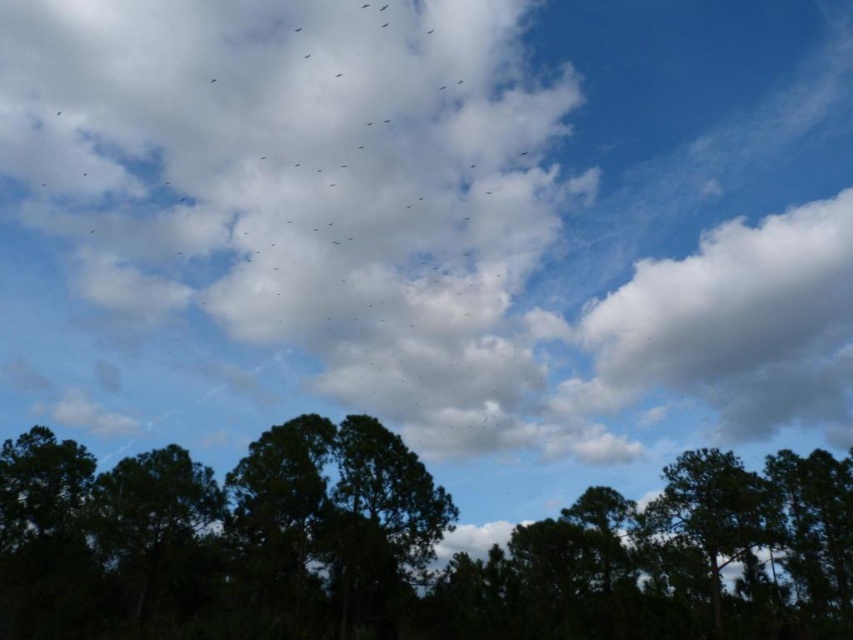
Question: Does white fluffy cloud at upper center appear on the right side of dark green foliage at center?

Choices:
 (A) yes
 (B) no

Answer: (B)

Question: Among these points, which one is farthest from the camera?

Choices:
 (A) (543, 435)
 (B) (519, 576)

Answer: (A)

Question: Which object appears farthest from the camera in this image?

Choices:
 (A) white fluffy cloud at upper center
 (B) dark green foliage at center

Answer: (A)

Question: Is white fluffy cloud at upper center to the left of dark green foliage at center from the viewer's perspective?

Choices:
 (A) no
 (B) yes

Answer: (B)

Question: Considering the relative positions of white fluffy cloud at upper center and dark green foliage at center in the image provided, where is white fluffy cloud at upper center located with respect to dark green foliage at center?

Choices:
 (A) left
 (B) right

Answer: (A)